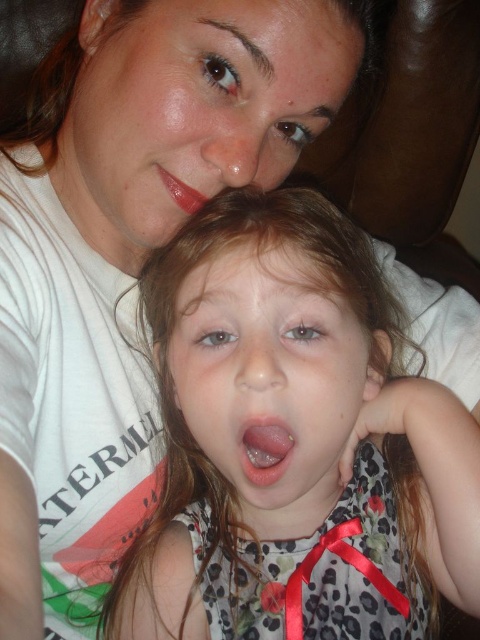
Is matte white face at upper center taller than pink glossy lips at center?

Correct, matte white face at upper center is much taller as pink glossy lips at center.

Is point (123, 182) positioned behind point (284, 426)?

That is True.

What do you see at coordinates (193, 106) in the screenshot?
I see `matte white face at upper center` at bounding box center [193, 106].

Locate an element on the screen. The height and width of the screenshot is (640, 480). matte white face at upper center is located at coordinates (193, 106).

What do you see at coordinates (269, 378) in the screenshot? This screenshot has width=480, height=640. I see `smooth skin face at center` at bounding box center [269, 378].

Who is positioned more to the left, smooth skin face at center or pink glossy lips at center?

pink glossy lips at center

The width and height of the screenshot is (480, 640). What do you see at coordinates (269, 378) in the screenshot?
I see `smooth skin face at center` at bounding box center [269, 378].

This screenshot has width=480, height=640. What are the coordinates of `smooth skin face at center` in the screenshot? It's located at (269, 378).

Who is shorter, floral-patterned dress at center or glossy matte lips at center?

With less height is glossy matte lips at center.

Can you confirm if floral-patterned dress at center is thinner than glossy matte lips at center?

No.

You are a GUI agent. You are given a task and a screenshot of the screen. Output one action in this format:
    pyautogui.click(x=<x>, y=<y>)
    Task: Click on the floral-patterned dress at center
    This screenshot has height=640, width=480.
    Given the screenshot: What is the action you would take?
    pyautogui.click(x=295, y=442)